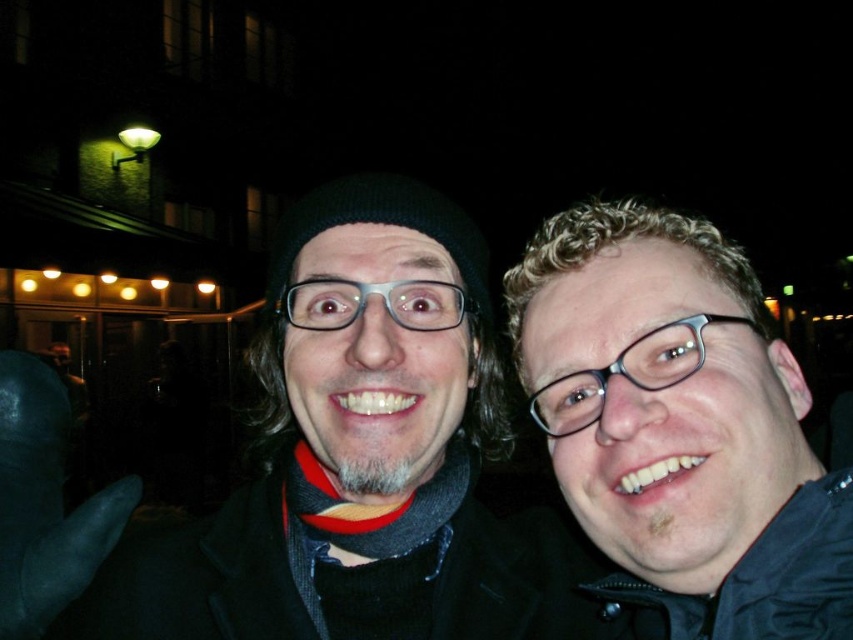
Does matte black jacket at center appear on the left side of matte black jacket at right?

Correct, you'll find matte black jacket at center to the left of matte black jacket at right.

Between point (498, 440) and point (828, 508), which one is positioned behind?

Point (498, 440)

Is point (12, 621) farther from viewer compared to point (637, 248)?

Yes, it is.

This screenshot has height=640, width=853. I want to click on matte black jacket at center, so click(x=318, y=467).